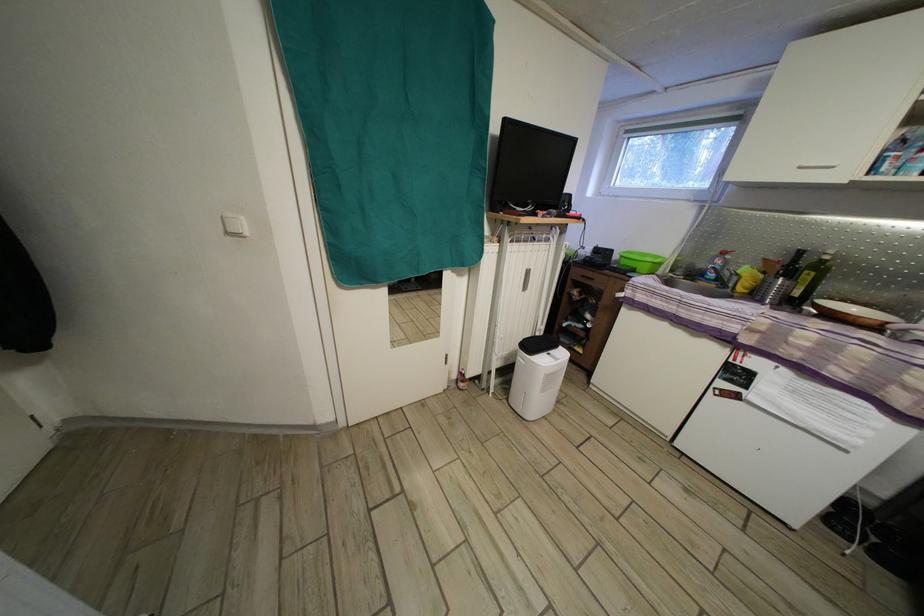
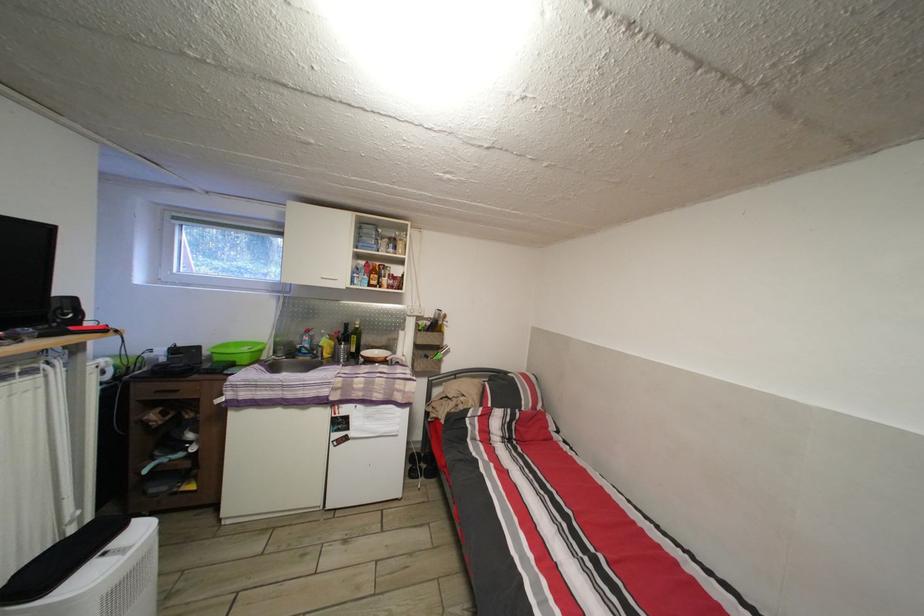
The point at (742, 285) is marked in the first image. Where is the corresponding point in the second image?

(327, 355)